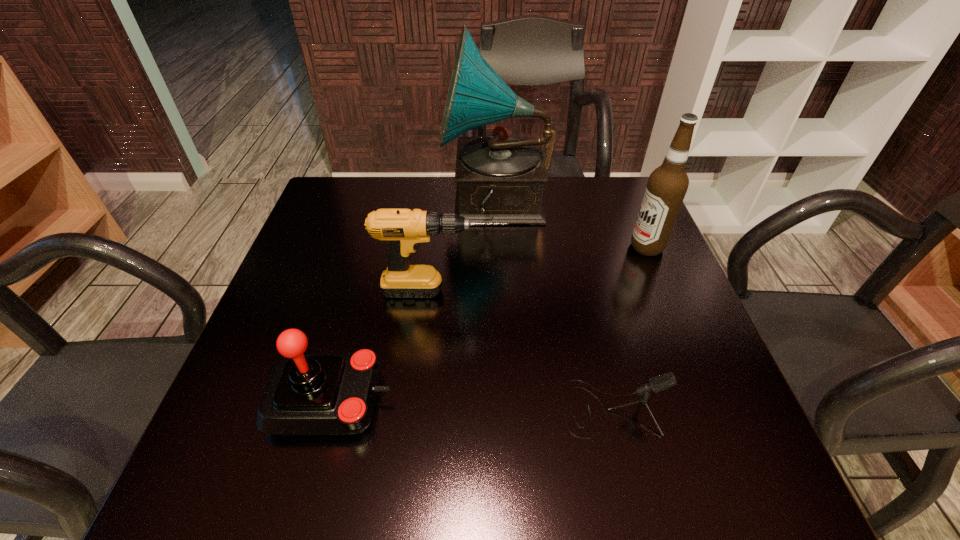
At what (x,y) coordinates should I click in order to perform the action: click on the farthest object. Please return your answer as a coordinate pair (x, y). Looking at the image, I should click on (500, 178).

The image size is (960, 540). Identify the location of the tallest object. click(500, 178).

Identify the location of the second tallest object. (667, 185).

You are a GUI agent. You are given a task and a screenshot of the screen. Output one action in this format:
    pyautogui.click(x=<x>, y=<y>)
    Task: Click on the rightmost object
    
    Given the screenshot: What is the action you would take?
    pyautogui.click(x=667, y=185)

You are a GUI agent. You are given a task and a screenshot of the screen. Output one action in this format:
    pyautogui.click(x=<x>, y=<y>)
    Task: Click on the drill
    The height and width of the screenshot is (540, 960).
    Given the screenshot: What is the action you would take?
    pyautogui.click(x=404, y=229)

What are the coordinates of `the third tallest object` in the screenshot? It's located at (404, 229).

Where is `joystick`? joystick is located at coordinates (306, 394).

What are the coordinates of `the shortest object` in the screenshot? It's located at (659, 383).

The width and height of the screenshot is (960, 540). What are the coordinates of `free space located 0.270m on the horn of the record player` in the screenshot? It's located at (346, 203).

The height and width of the screenshot is (540, 960). Find the location of `vacant space located 0.270m on the horn of the record player`. vacant space located 0.270m on the horn of the record player is located at coordinates (346, 203).